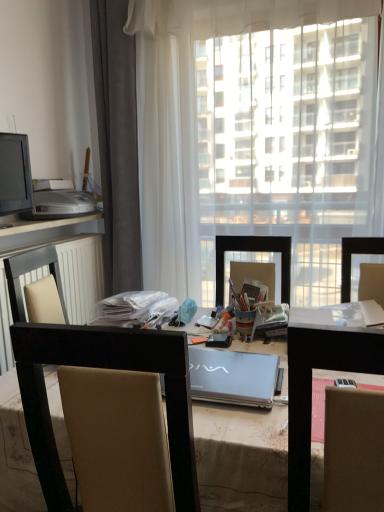
Question: Is metallic silver laptop at center surrounded by transparent fabric at center?

Choices:
 (A) yes
 (B) no

Answer: (B)

Question: Considering the relative positions of transparent fabric at center and metallic silver laptop at center in the image provided, is transparent fabric at center to the left of metallic silver laptop at center from the viewer's perspective?

Choices:
 (A) yes
 (B) no

Answer: (A)

Question: Would you consider transparent fabric at center to be distant from metallic silver laptop at center?

Choices:
 (A) no
 (B) yes

Answer: (B)

Question: Considering the relative sizes of transparent fabric at center and metallic silver laptop at center in the image provided, is transparent fabric at center wider than metallic silver laptop at center?

Choices:
 (A) yes
 (B) no

Answer: (B)

Question: From a real-world perspective, is transparent fabric at center on top of metallic silver laptop at center?

Choices:
 (A) yes
 (B) no

Answer: (A)

Question: Considering the positions of point click(x=94, y=290) and point click(x=11, y=200), is point click(x=94, y=290) closer or farther from the camera than point click(x=11, y=200)?

Choices:
 (A) closer
 (B) farther

Answer: (B)

Question: From a real-world perspective, relative to matte black monitor at left, is black plastic computer desk at lower left vertically above or below?

Choices:
 (A) above
 (B) below

Answer: (B)

Question: Looking at their shapes, would you say black plastic computer desk at lower left is wider or thinner than matte black monitor at left?

Choices:
 (A) thin
 (B) wide

Answer: (B)

Question: From the image's perspective, is black plastic computer desk at lower left positioned above or below matte black monitor at left?

Choices:
 (A) below
 (B) above

Answer: (A)

Question: Is beige fabric chair at center in front of or behind gray fabric curtain at left in the image?

Choices:
 (A) front
 (B) behind

Answer: (A)

Question: Considering the positions of beige fabric chair at center and gray fabric curtain at left in the image, is beige fabric chair at center wider or thinner than gray fabric curtain at left?

Choices:
 (A) thin
 (B) wide

Answer: (B)

Question: Does point pos(44,496) appear closer or farther from the camera than point pos(135,152)?

Choices:
 (A) farther
 (B) closer

Answer: (B)

Question: In terms of size, does beige fabric chair at center appear bigger or smaller than gray fabric curtain at left?

Choices:
 (A) big
 (B) small

Answer: (B)

Question: In the image, is metallic silver laptop at center positioned in front of or behind transparent fabric at center?

Choices:
 (A) behind
 (B) front

Answer: (B)

Question: From the image's perspective, is metallic silver laptop at center located above or below transparent fabric at center?

Choices:
 (A) above
 (B) below

Answer: (B)